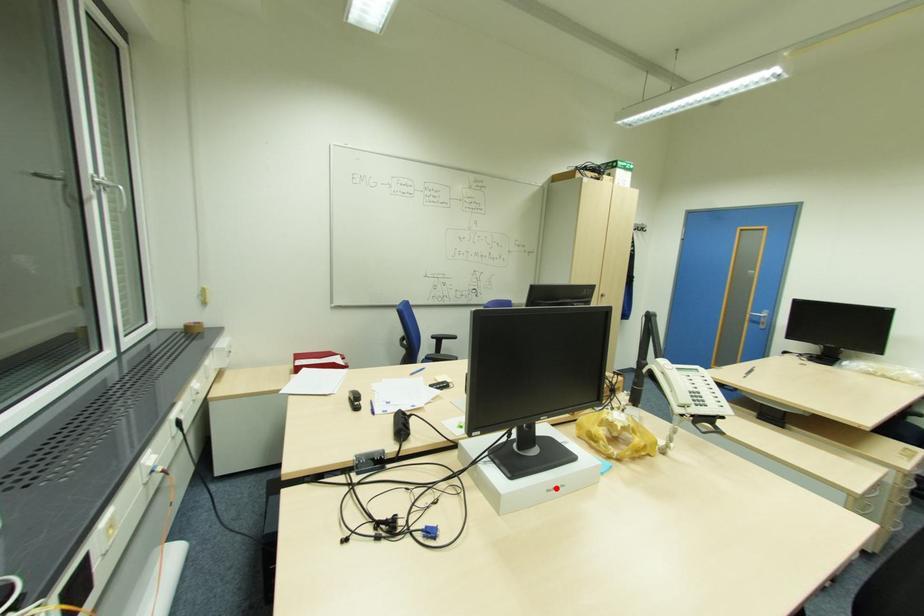
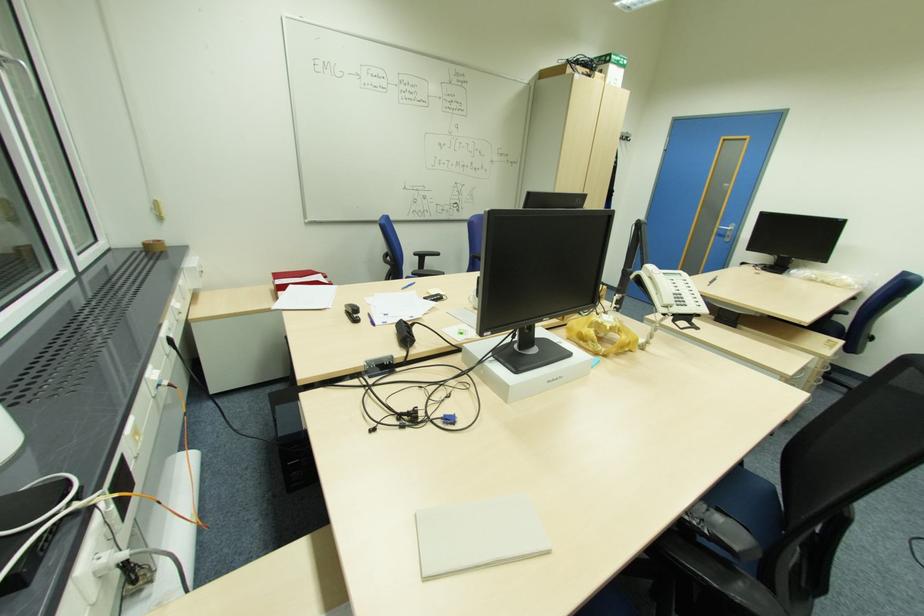
Question: A red point is marked in image1. In image2, is the corresponding 3D point closer to the camera or farther? Reply with the corresponding letter.

Choices:
 (A) The corresponding 3D point is closer.
 (B) The corresponding 3D point is farther.

Answer: (A)